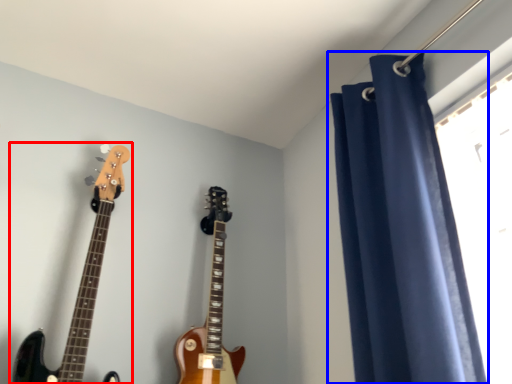
Question: Among these objects, which one is nearest to the camera, guitar (highlighted by a red box) or curtain (highlighted by a blue box)?

Choices:
 (A) guitar
 (B) curtain

Answer: (B)